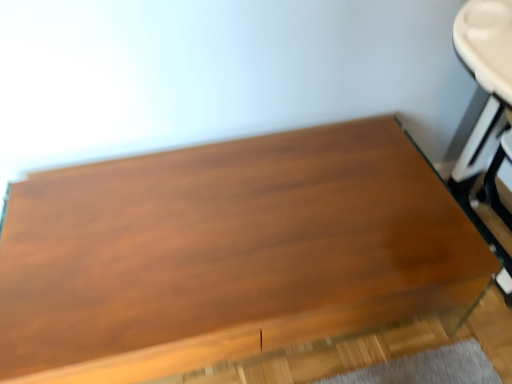
This screenshot has width=512, height=384. Identify the location of satin wood table at center. (227, 253).

The image size is (512, 384). Describe the element at coordinates (227, 253) in the screenshot. I see `satin wood table at center` at that location.

Locate an element on the screen. The width and height of the screenshot is (512, 384). satin wood table at center is located at coordinates (227, 253).